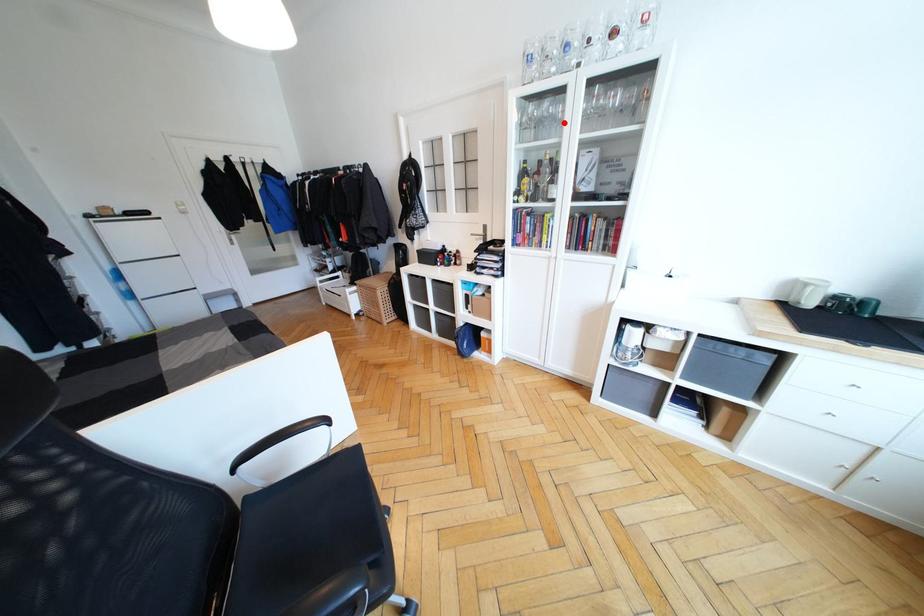
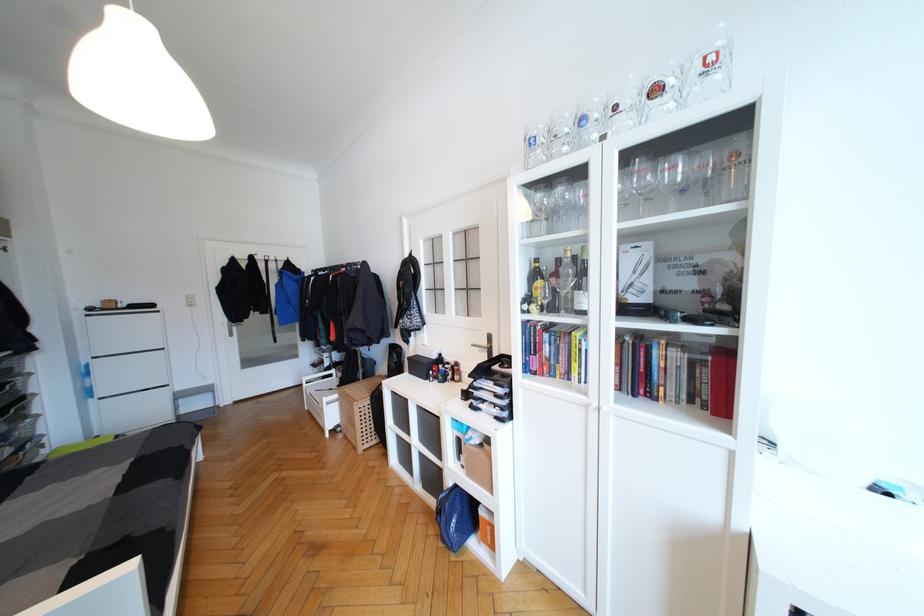
Find the pixel in the second image that matches the highlighted location in the first image.

(587, 212)